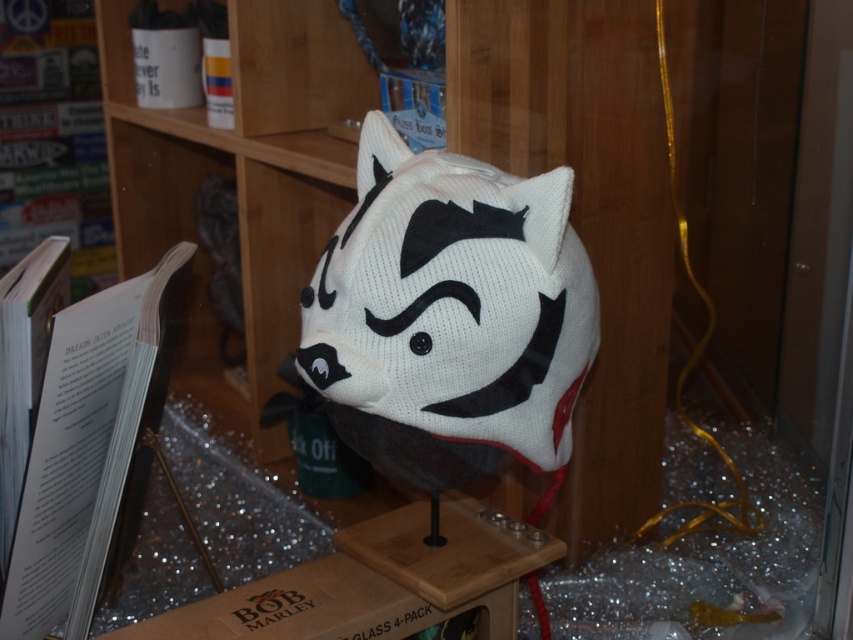
Is wooden bookshelf at center above white knitted hat at center?

Yes, wooden bookshelf at center is above white knitted hat at center.

Does wooden bookshelf at center appear on the right side of white knitted hat at center?

No, wooden bookshelf at center is not to the right of white knitted hat at center.

Does point (131, 125) lie in front of point (496, 332)?

No, it is behind (496, 332).

Locate an element on the screen. wooden bookshelf at center is located at coordinates (585, 214).